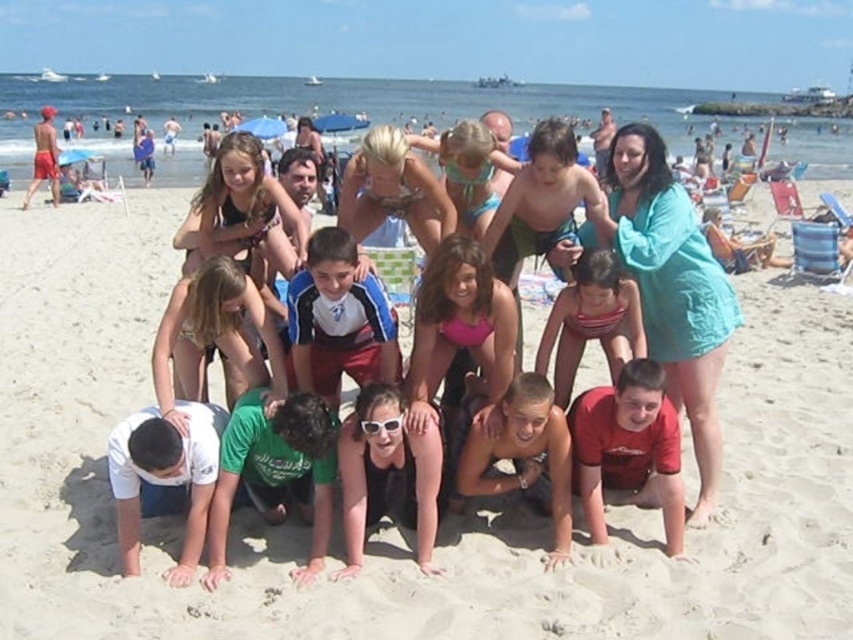
You are a photographer trying to capture a group photo of the beige sandy beach at center and the striped swimsuit at center. Since you want to ensure both are clearly visible, which object should you focus on first to avoid blurriness?

The beige sandy beach at center is larger in size than the striped swimsuit at center, so you should focus on the beige sandy beach at center first to ensure it is sharp before adjusting focus for the smaller striped swimsuit at center.

You are a photographer trying to capture a photo of the beige sandy beach at center and the teal fabric shirt at upper right. Which object should you focus on first if you want to ensure both are in focus?

The beige sandy beach at center is positioned over the teal fabric shirt at upper right, so focusing on the beige sandy beach at center first will ensure both are in focus since it is closer to the camera.

You are standing at the beach and want to take a photo of the group. You notice two points marked on the sand at coordinates point (85, 618) and point (665, 456). Which point is closer to you if you are facing the ocean?

Point (85, 618) is in front of point (665, 456), so it is closer to you when facing the ocean.